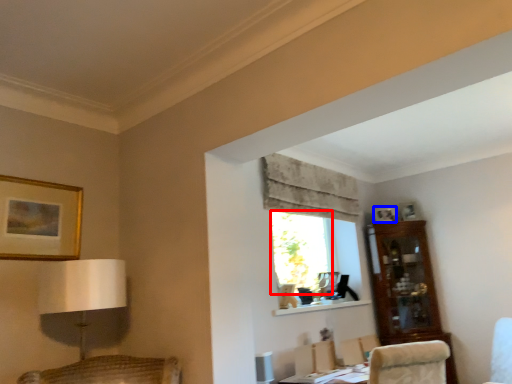
Question: Which point is closer to the camera, window (highlighted by a red box) or picture frame (highlighted by a blue box)?

Choices:
 (A) window
 (B) picture frame

Answer: (A)